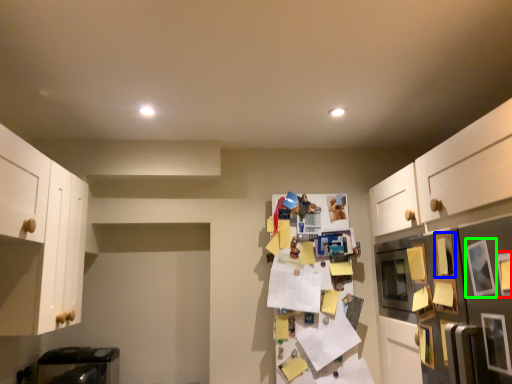
Question: Estimate the real-world distances between objects in this image. Which object is closer to picture frame (highlighted by a red box), picture frame (highlighted by a blue box) or picture frame (highlighted by a green box)?

Choices:
 (A) picture frame
 (B) picture frame

Answer: (B)